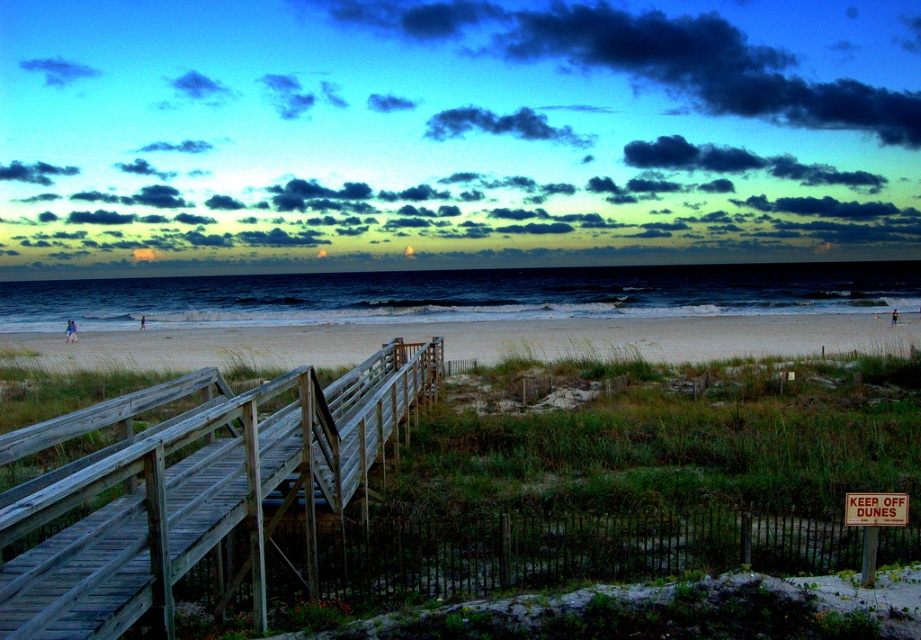
You are standing on the wooden staircase leading down to the beach and want to walk towards the white sand at center. Which direction should you move relative to the wooden rail at center to reach the sand?

The wooden rail at center is positioned on the right side of white sand at center, so to reach the white sand at center, you should move to the left of the wooden rail at center.

You are a painter standing at the top of the wooden staircase. You want to paint the wooden rail at center and the white sand at center. Which object has a smaller width in the scene?

The wooden rail at center has a lesser width compared to the white sand at center.

You are standing at the top of the wooden staircase on the beach and want to grab the wooden rail at center to descend carefully. Based on the scene description, where exactly is the wooden rail located in relation to the staircase?

The wooden rail at center is located at point 0.764 along the horizontal axis and 0.207 along the vertical axis relative to the staircase, making it centrally positioned for grip while descending.